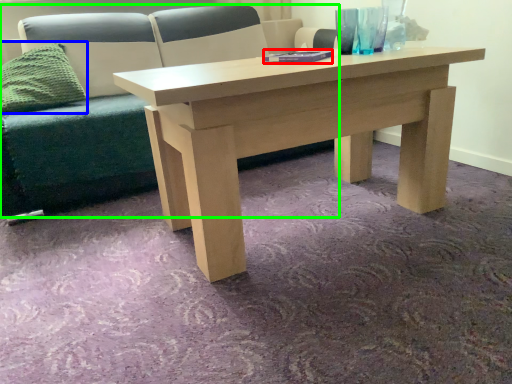
Question: Based on their relative distances, which object is nearer to book (highlighted by a red box)? Choose from pillow (highlighted by a blue box) and studio couch (highlighted by a green box).

Choices:
 (A) pillow
 (B) studio couch

Answer: (B)